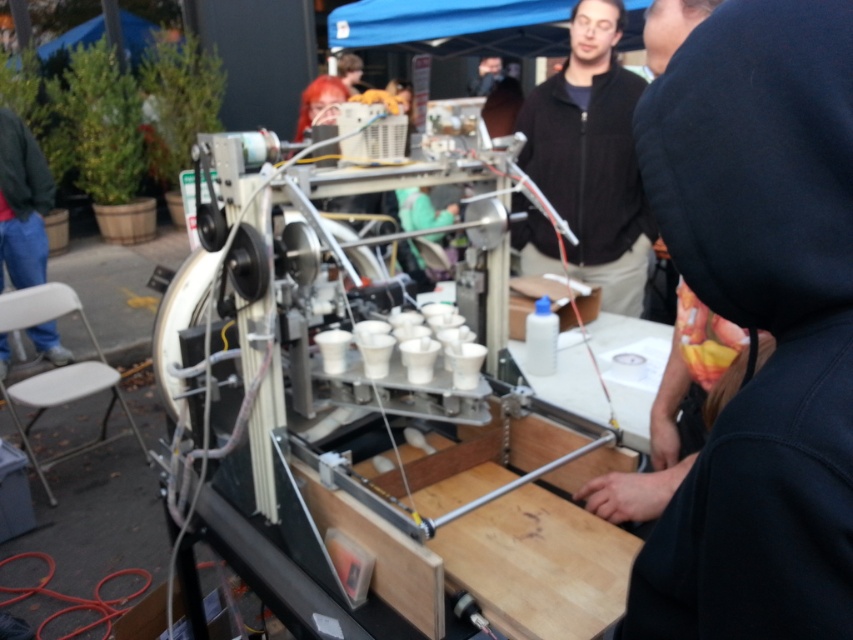
Does black zip-up jacket at upper center have a larger size compared to white plastic chair at lower left?

Actually, black zip-up jacket at upper center might be smaller than white plastic chair at lower left.

I want to click on black zip-up jacket at upper center, so click(592, 156).

The height and width of the screenshot is (640, 853). Describe the element at coordinates (592, 156) in the screenshot. I see `black zip-up jacket at upper center` at that location.

Identify the location of black zip-up jacket at upper center. Image resolution: width=853 pixels, height=640 pixels. point(592,156).

In the scene shown: Who is lower down, blue jeans at lower left or white plastic chair at lower left?

white plastic chair at lower left

Can you confirm if blue jeans at lower left is shorter than white plastic chair at lower left?

No, blue jeans at lower left is not shorter than white plastic chair at lower left.

Describe the element at coordinates (22, 204) in the screenshot. I see `blue jeans at lower left` at that location.

I want to click on blue jeans at lower left, so tap(22, 204).

Who is shorter, blue fabric canopy at upper center or blue jeans at lower left?

blue fabric canopy at upper center is shorter.

This screenshot has width=853, height=640. What do you see at coordinates (454, 26) in the screenshot?
I see `blue fabric canopy at upper center` at bounding box center [454, 26].

Is point (347, 38) closer to camera compared to point (53, 346)?

No, it is behind (53, 346).

Locate an element on the screen. The height and width of the screenshot is (640, 853). blue fabric canopy at upper center is located at coordinates (454, 26).